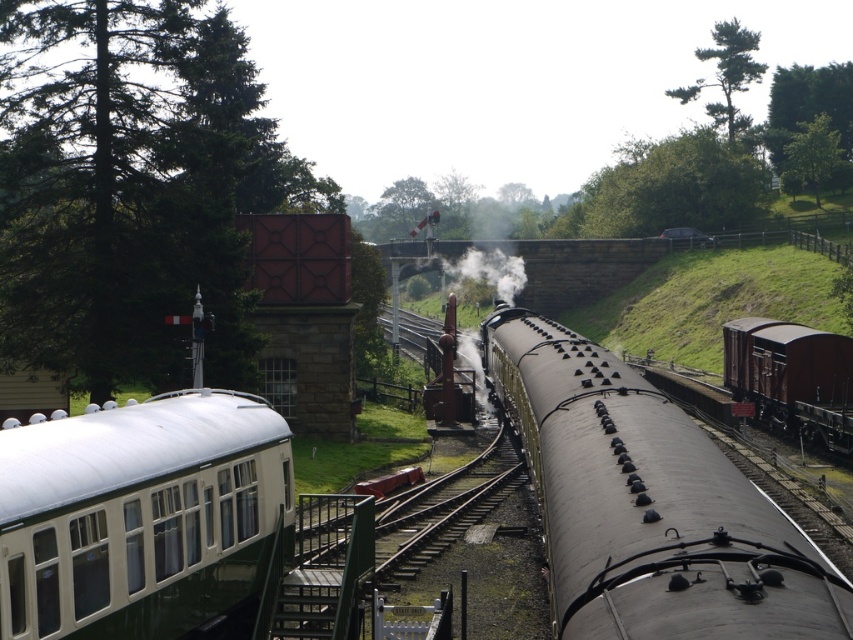
You are standing at the railway station and want to take a photo of the steam locomotive. There is a point at coordinates point (712, 83) that you need to consider. Is this point closer to you or farther away than the steam locomotive?

The point at (712, 83) is 241.24 meters away from the camera. Since the steam locomotive is in the foreground emitting smoke, it is closer than the point, so the point is farther away than the steam locomotive.

You are a passenger on the train and looking out the window. You see a green leafy tree at upper left and a brown matte freight car at right. Which object is bigger in size?

The green leafy tree at upper left is larger in size than the brown matte freight car at right.